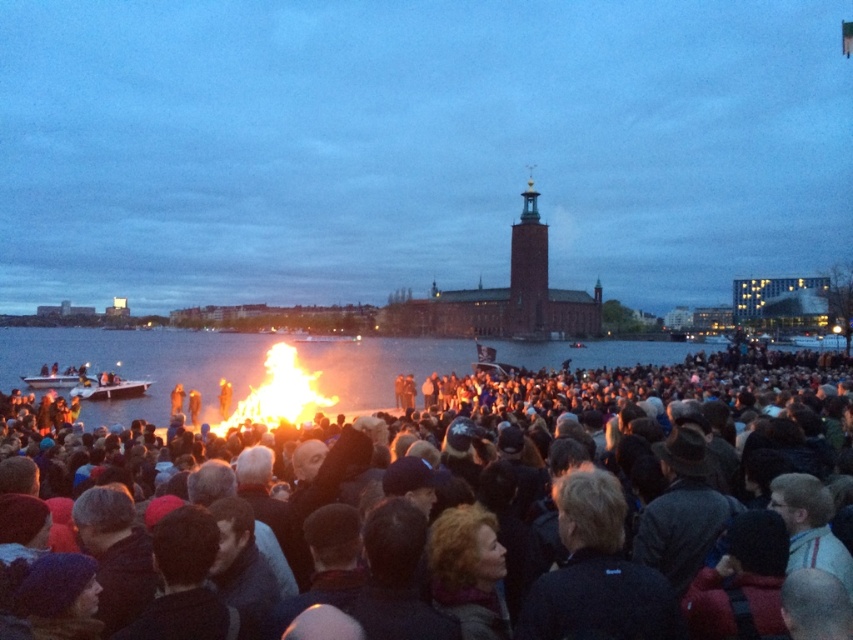
You are standing at the waterfront and want to take a photo of the dark clothing crowd at center and the flaming wood at center. Which object should you position to the left side of your camera frame to include both in the shot?

To include both the dark clothing crowd at center and the flaming wood at center in your photo, position the dark clothing crowd at center to the left side of your camera frame since it is located to the right of the flaming wood at center.

You are a photographer planning to take a wide shot of the brick building at center and the dark clothing crowd at center. Based on their widths, which one should you frame first to ensure both fit in the photo?

The brick building at center is wider than the dark clothing crowd at center, so you should frame the brick building at center first to ensure both fit in the photo.

You are standing on the dock and want to walk to the dark clothing crowd at center. Which direction should you walk relative to the transparent water at center?

You should walk to the right of the transparent water at center to reach the dark clothing crowd at center.